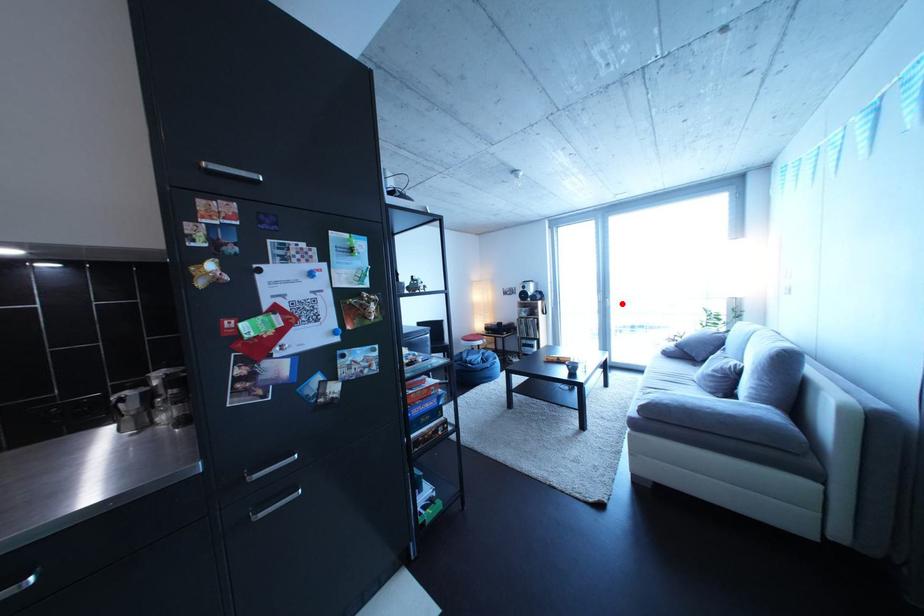
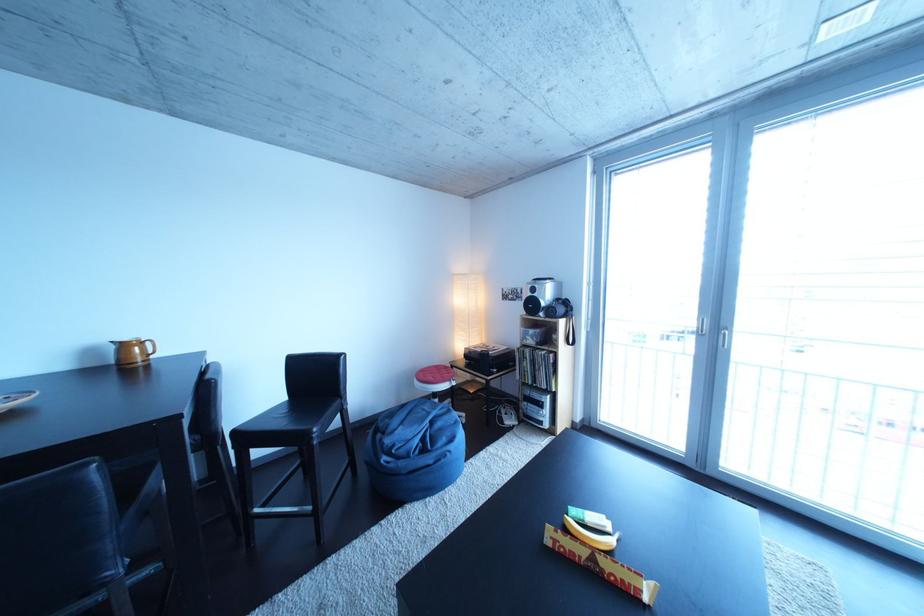
Where in the second image is the point corresponding to the highlighted location from the first image?

(743, 334)